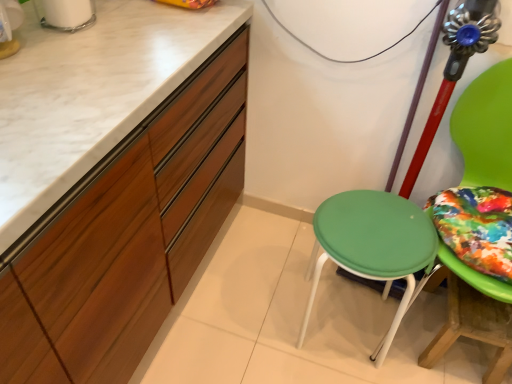
Identify the location of vacant space situated above matte wood cabinetry at left (from a real-world perspective). The image size is (512, 384). (84, 57).